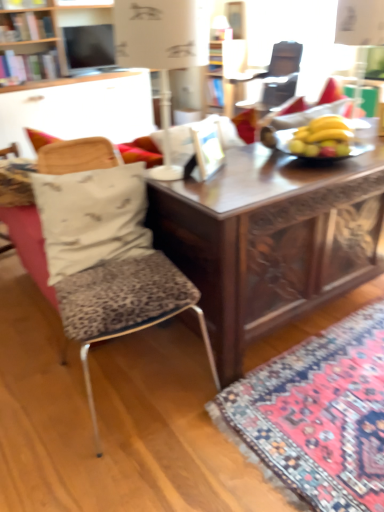
Where is `blank space situated above carpet with intricate patterns at lower right (from a real-world perspective)`? This screenshot has height=512, width=384. blank space situated above carpet with intricate patterns at lower right (from a real-world perspective) is located at coordinates (345, 392).